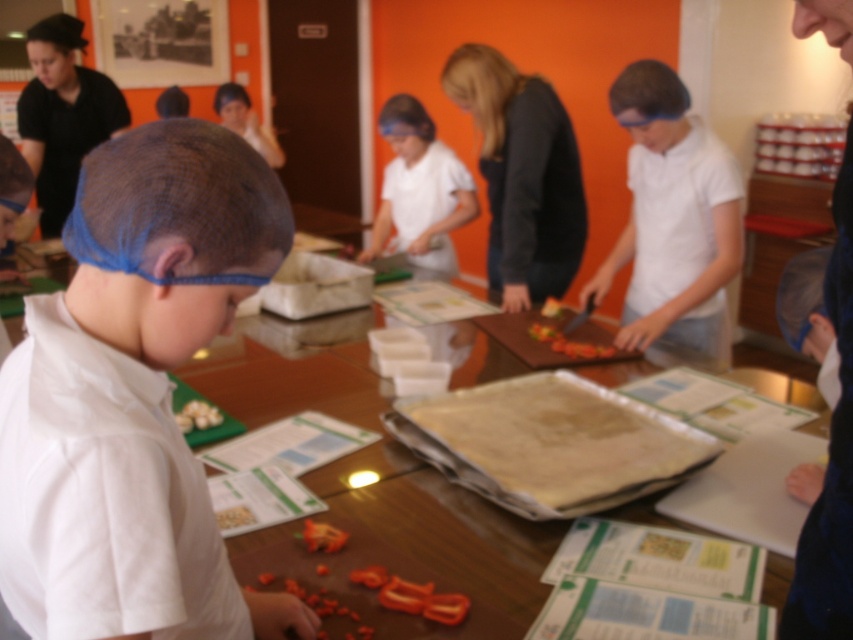
Does point (229, 148) come behind point (668, 326)?

That is False.

Is white matte chef hat at center to the right of white matte shirt at center from the viewer's perspective?

In fact, white matte chef hat at center is to the left of white matte shirt at center.

Does point (219, 308) lie in front of point (614, 77)?

Yes, it is.

Locate an element on the screen. white matte chef hat at center is located at coordinates (134, 396).

Between wooden table at center and white matte garlic at center, which one is positioned higher?

wooden table at center is higher up.

Which of these two, wooden table at center or white matte garlic at center, stands shorter?

white matte garlic at center is shorter.

This screenshot has width=853, height=640. I want to click on wooden table at center, so pos(379,460).

Does wooden table at center appear under dark gray sweater at center?

Yes, wooden table at center is below dark gray sweater at center.

Based on the photo, between wooden table at center and dark gray sweater at center, which one has more height?

dark gray sweater at center is taller.

Does point (311, 381) come closer to viewer compared to point (570, 200)?

Yes, it is in front of point (570, 200).

In order to click on wooden table at center in this screenshot , I will do `click(379, 460)`.